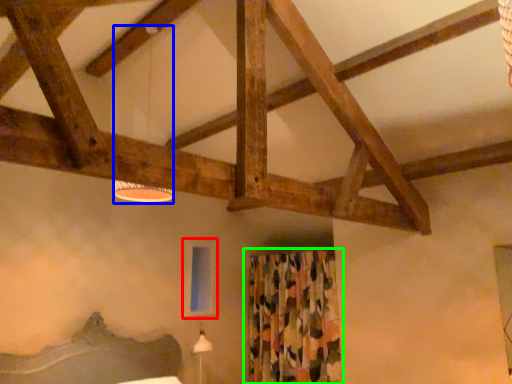
Question: Estimate the real-world distances between objects in this image. Which object is closer to window screen (highlighted by a red box), lamp (highlighted by a blue box) or curtain (highlighted by a green box)?

Choices:
 (A) lamp
 (B) curtain

Answer: (B)